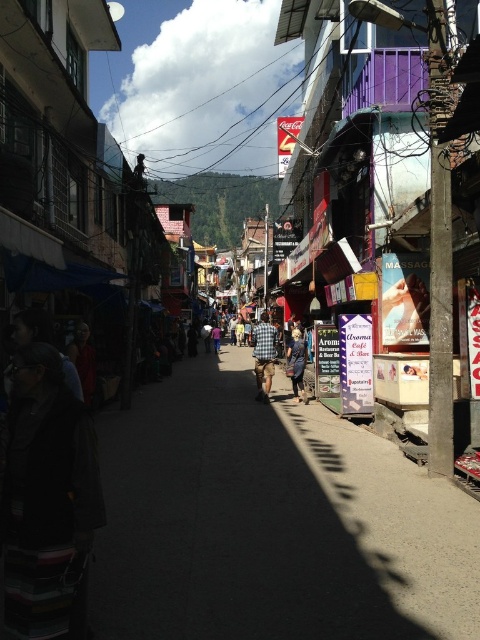
Question: Which point is farther to the camera?

Choices:
 (A) concrete sidewalk at center
 (B) checkered fabric shirt at center
 (C) plaid shirt at center

Answer: (C)

Question: Which of these objects is positioned farthest from the checkered fabric shirt at center?

Choices:
 (A) plaid shirt at center
 (B) concrete sidewalk at center
 (C) dark brown monk at center

Answer: (C)

Question: Which point appears closest to the camera in this image?

Choices:
 (A) (88, 349)
 (B) (352, 605)
 (C) (257, 364)
 (D) (296, 378)

Answer: (B)

Question: Is concrete sidewalk at center wider than plaid shirt at center?

Choices:
 (A) yes
 (B) no

Answer: (A)

Question: Considering the relative positions of concrete sidewalk at center and checkered fabric shirt at center in the image provided, where is concrete sidewalk at center located with respect to checkered fabric shirt at center?

Choices:
 (A) below
 (B) above

Answer: (A)

Question: Is checkered fabric shirt at center to the right of plaid shirt at center from the viewer's perspective?

Choices:
 (A) no
 (B) yes

Answer: (A)